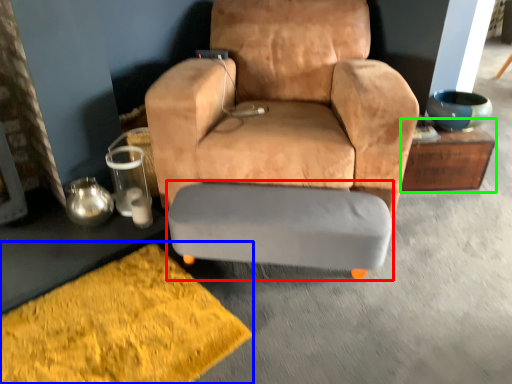
Question: Which is nearer to the swivel chair (highlighted by a red box)? doormat (highlighted by a blue box) or table (highlighted by a green box).

Choices:
 (A) doormat
 (B) table

Answer: (A)